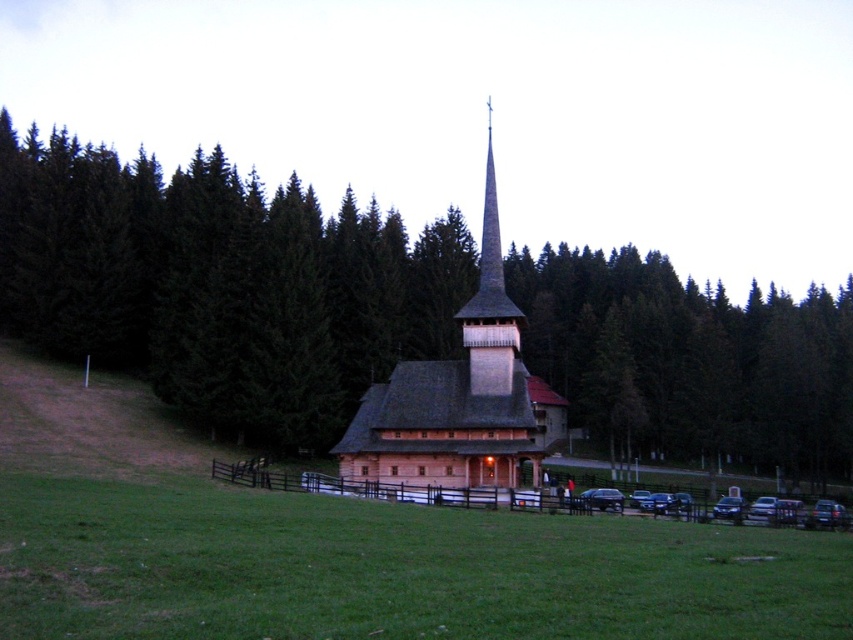
Which is in front, point (306, 266) or point (619, 540)?

Point (619, 540)

Is green textured pine tree at center positioned before green grass at lower center?

No.

Locate an element on the screen. The height and width of the screenshot is (640, 853). green textured pine tree at center is located at coordinates (221, 285).

What do you see at coordinates (459, 400) in the screenshot? I see `wooden church at center` at bounding box center [459, 400].

Locate an element on the screen. The height and width of the screenshot is (640, 853). wooden church at center is located at coordinates (459, 400).

This screenshot has height=640, width=853. What do you see at coordinates (459, 400) in the screenshot? I see `wooden church at center` at bounding box center [459, 400].

This screenshot has height=640, width=853. Identify the location of wooden church at center. (459, 400).

Who is shorter, green grass at lower center or wooden spire at center?

green grass at lower center is shorter.

Does green grass at lower center have a smaller size compared to wooden spire at center?

Correct, green grass at lower center occupies less space than wooden spire at center.

Is point (598, 586) farther from camera compared to point (506, 380)?

No, it is not.

This screenshot has width=853, height=640. I want to click on green grass at lower center, so click(x=392, y=570).